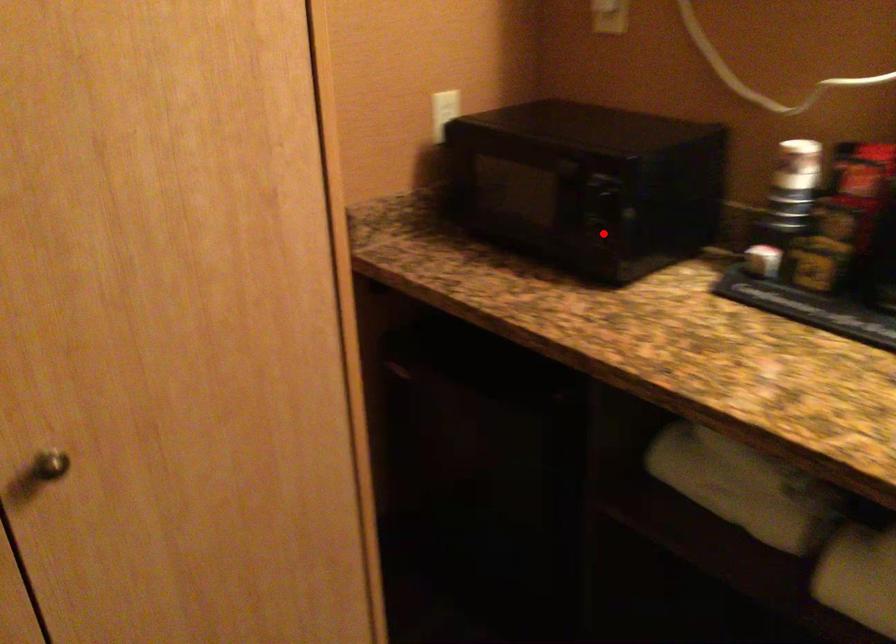
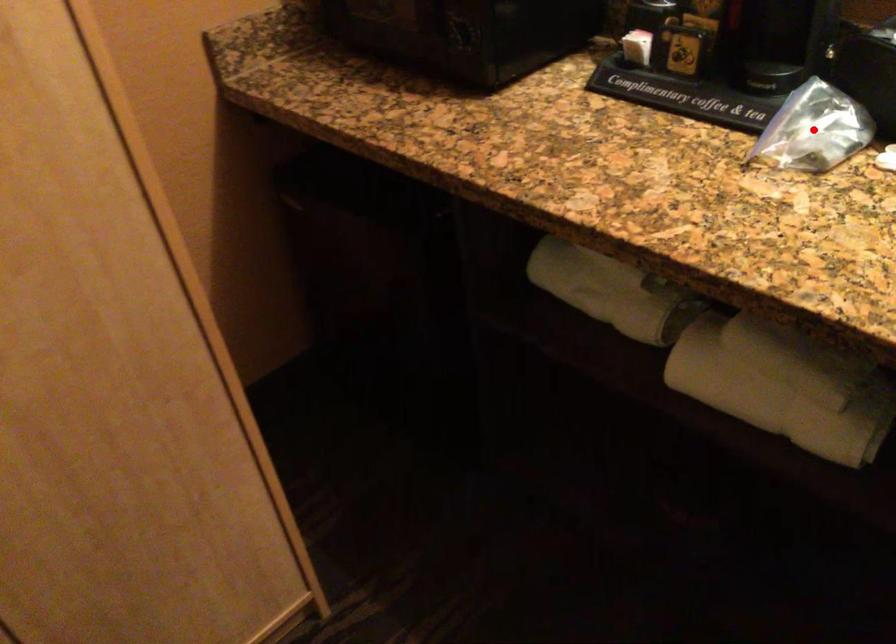
I am providing you with two images of the same scene from different viewpoints. A red point is marked on the first image and another point is marked on the second image. Does the point marked in image1 correspond to the same location as the one in image2?

No